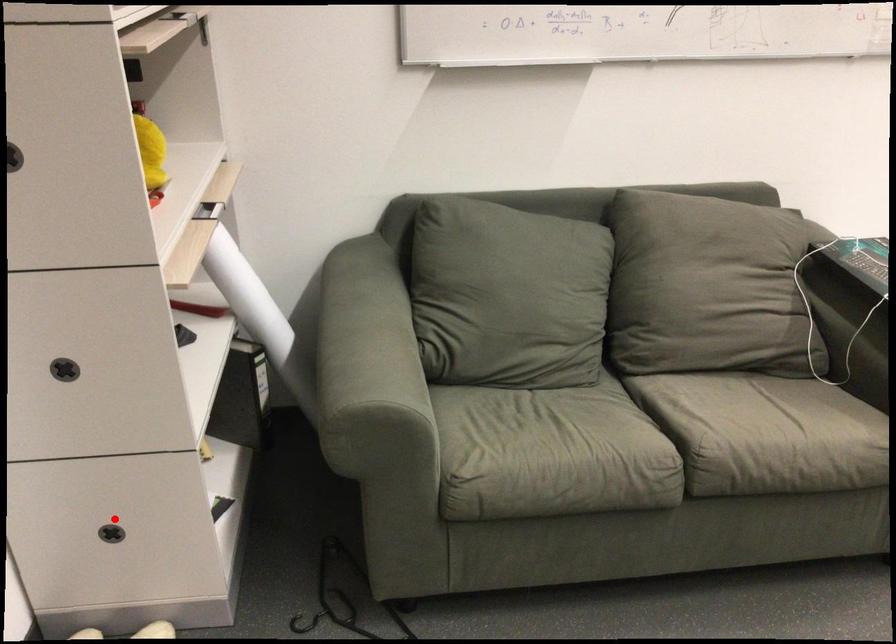
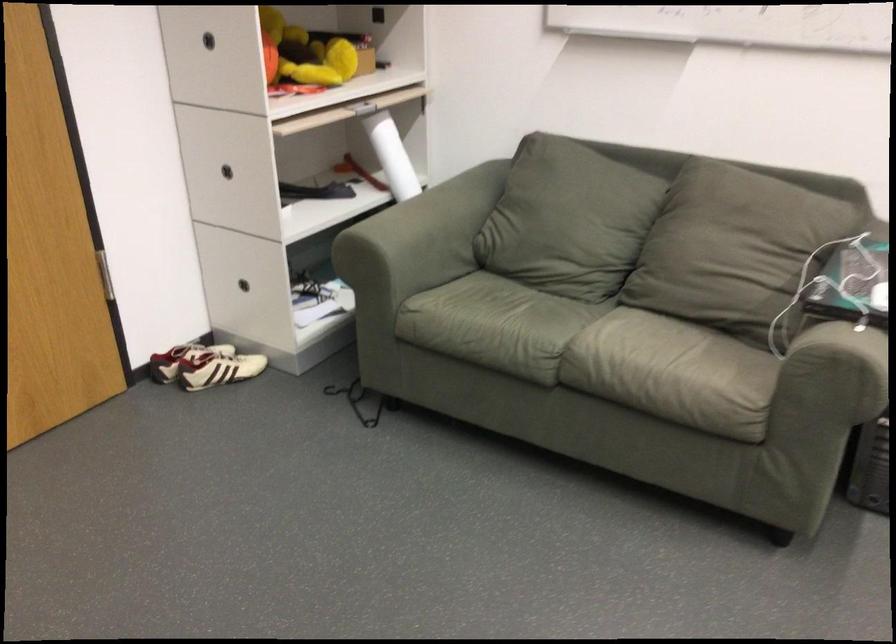
Question: I am providing you with two images of the same scene from different viewpoints. Given a red point in image1, look at the same physical point in image2. Is it:

Choices:
 (A) Closer to the viewpoint
 (B) Farther from the viewpoint

Answer: (B)